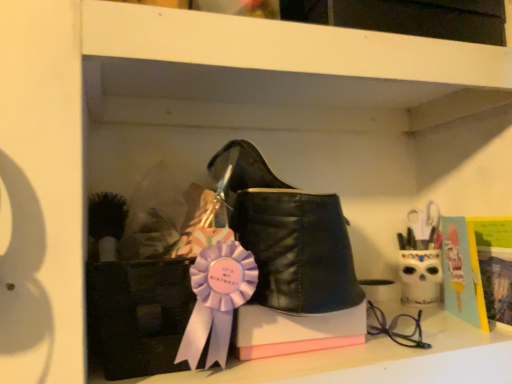
Question: From a real-world perspective, is black leather boot at center physically located above or below matte black glasses at lower right?

Choices:
 (A) below
 (B) above

Answer: (B)

Question: Is black leather boot at center inside the boundaries of matte black glasses at lower right, or outside?

Choices:
 (A) inside
 (B) outside

Answer: (B)

Question: Estimate the real-world distances between objects in this image. Which object is farther from the black leather boot at center?

Choices:
 (A) white matte shelf at upper center
 (B) matte black glasses at lower right

Answer: (B)

Question: Which object is positioned closest to the black leather boot at center?

Choices:
 (A) white matte shelf at upper center
 (B) matte black glasses at lower right

Answer: (A)